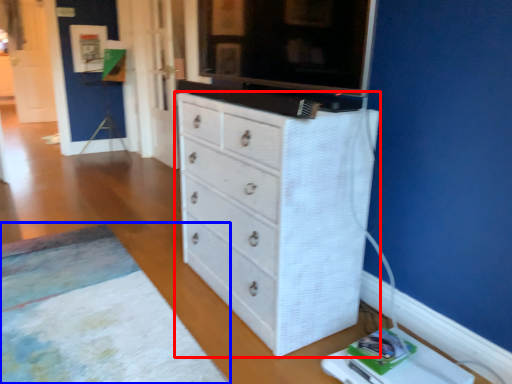
Question: Which of the following is the closest to the observer, chest of drawers (highlighted by a red box) or plain (highlighted by a blue box)?

Choices:
 (A) chest of drawers
 (B) plain

Answer: (B)